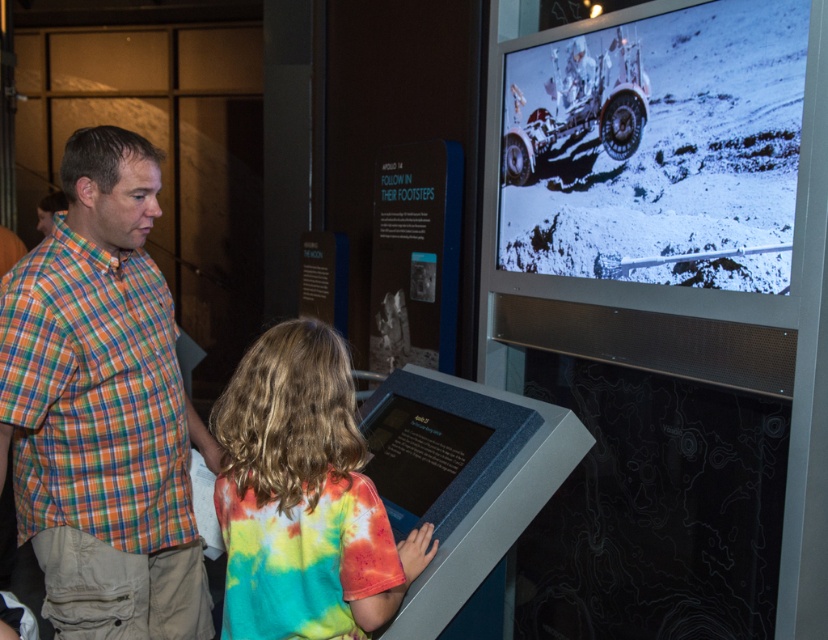
Question: Is the position of multicolored plaid shirt at left less distant than that of black matte display at center?

Choices:
 (A) yes
 (B) no

Answer: (A)

Question: Which object is positioned farthest from the multicolored plaid shirt at left?

Choices:
 (A) black matte display at center
 (B) tie-dye fabric shirt at center

Answer: (A)

Question: Which of the following is the farthest from the observer?

Choices:
 (A) metallic silver rover at upper right
 (B) multicolored plaid shirt at left
 (C) black matte display at center
 (D) tie-dye fabric shirt at center

Answer: (C)

Question: Does multicolored plaid shirt at left have a larger size compared to black matte display at center?

Choices:
 (A) yes
 (B) no

Answer: (A)

Question: Is metallic silver rover at upper right smaller than black matte display at center?

Choices:
 (A) yes
 (B) no

Answer: (B)

Question: Which point is farther to the camera?

Choices:
 (A) (283, 476)
 (B) (465, 474)
 (C) (518, 100)
 (D) (169, 612)

Answer: (C)